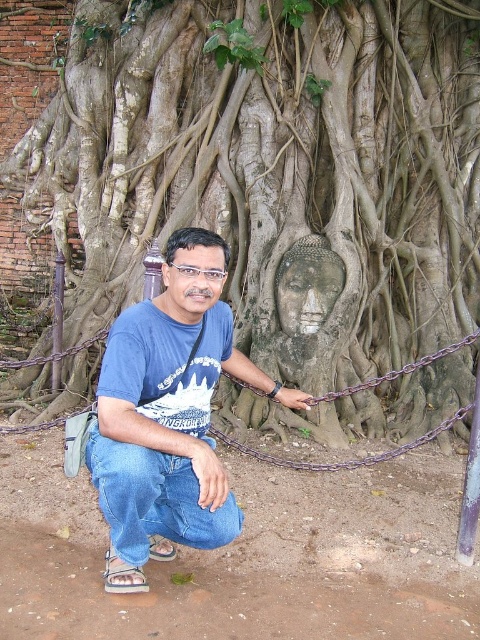
You are a photographer trying to capture the gray stone buddha head at center and the purple metallic chain at center in the same frame. Which object should you focus on first to ensure both are in focus?

You should focus on the gray stone buddha head at center first because it is closer to you than the purple metallic chain at center, so focusing on it will ensure both are in focus.

You are standing at the point where the man is squatting. If you want to take a photo of the gray stone buddha head at center, which is represented by point (x=275, y=164), where should you aim your camera?

You should aim your camera towards the center of the image where the gray stone buddha head at center is located, as it is represented by the point (x=275, y=164).